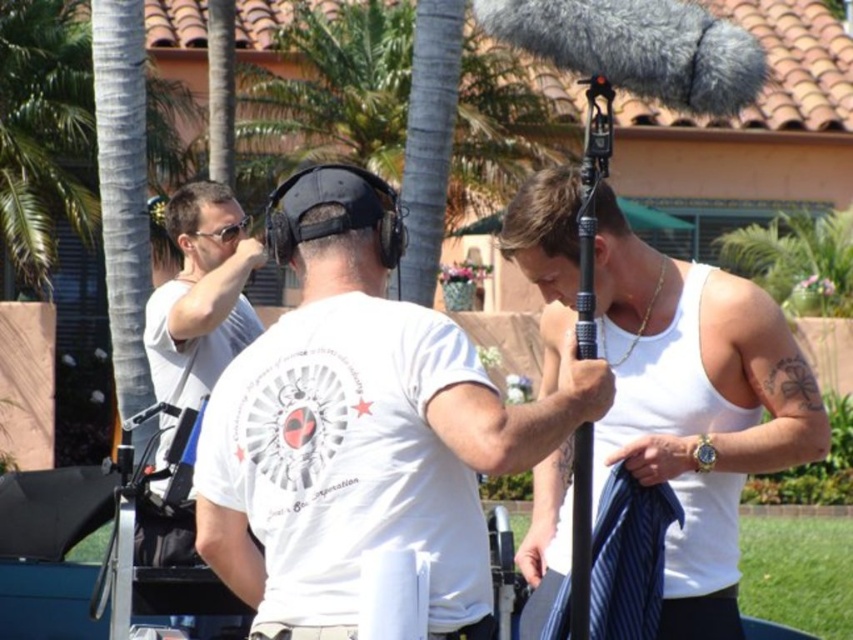
You are standing in the outdoor filming setup with palm trees and a building in the background. You need to find the white matte shirt at left. According to the coordinates provided, where exactly is it positioned?

The white matte shirt at left is located at point (200, 296).